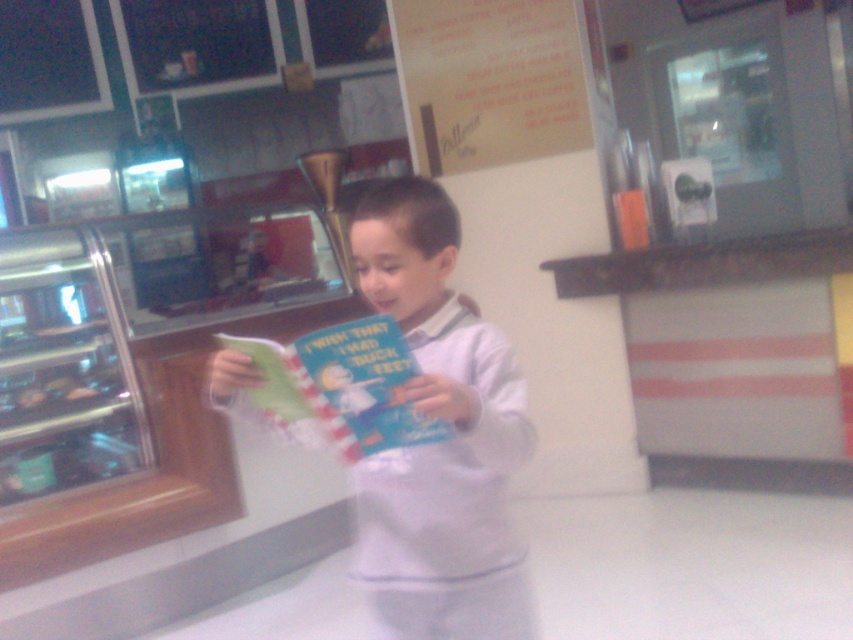
Question: Which object is the farthest from the green paper book at center?

Choices:
 (A) wooden signboard at upper center
 (B) white matte shirt at center

Answer: (A)

Question: Considering the relative positions of wooden signboard at upper center and green paper book at center in the image provided, where is wooden signboard at upper center located with respect to green paper book at center?

Choices:
 (A) right
 (B) left

Answer: (A)

Question: Among these points, which one is farthest from the camera?

Choices:
 (A) (432, 246)
 (B) (341, 400)

Answer: (A)

Question: Which point appears closest to the camera in this image?

Choices:
 (A) (415, 410)
 (B) (379, 611)

Answer: (A)

Question: In this image, where is white matte shirt at center located relative to wooden signboard at upper center?

Choices:
 (A) left
 (B) right

Answer: (A)

Question: Does white matte shirt at center appear on the right side of green paper book at center?

Choices:
 (A) yes
 (B) no

Answer: (A)